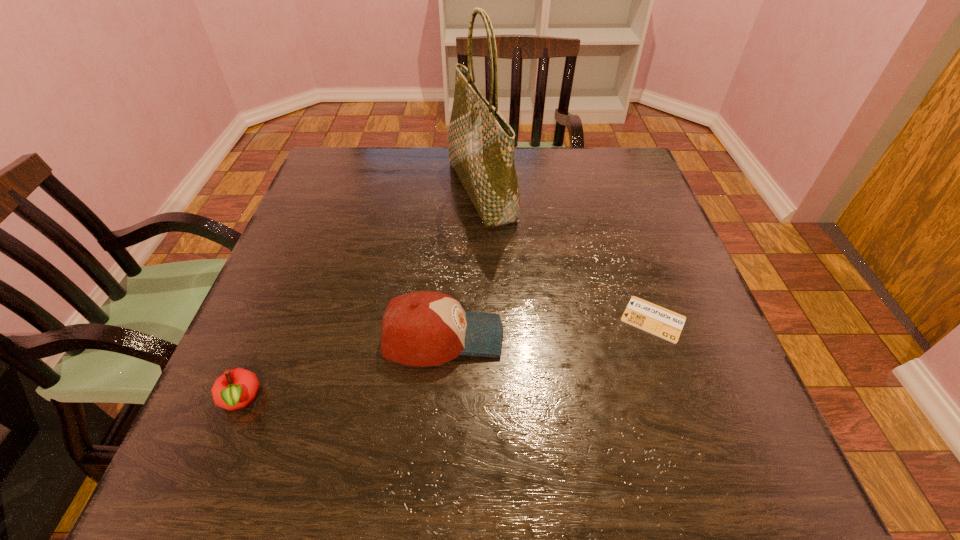
Where is `the third closest object relative to the leftmost object`? The width and height of the screenshot is (960, 540). the third closest object relative to the leftmost object is located at coordinates (666, 324).

Where is `vacant point that satisfies the following two spatial constraints: 1. on the back side of the leftmost object; 2. on the right side of the rightmost object`? Image resolution: width=960 pixels, height=540 pixels. vacant point that satisfies the following two spatial constraints: 1. on the back side of the leftmost object; 2. on the right side of the rightmost object is located at coordinates (273, 319).